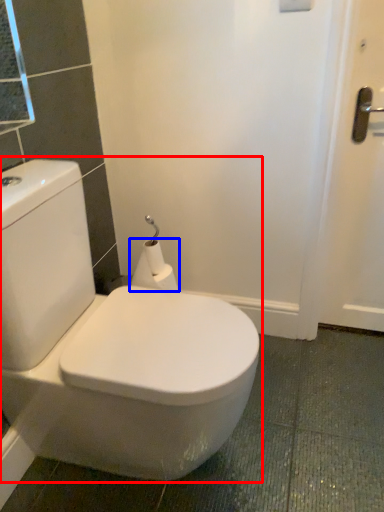
Question: Among these objects, which one is nearest to the camera, toilet (highlighted by a red box) or toilet paper (highlighted by a blue box)?

Choices:
 (A) toilet
 (B) toilet paper

Answer: (A)